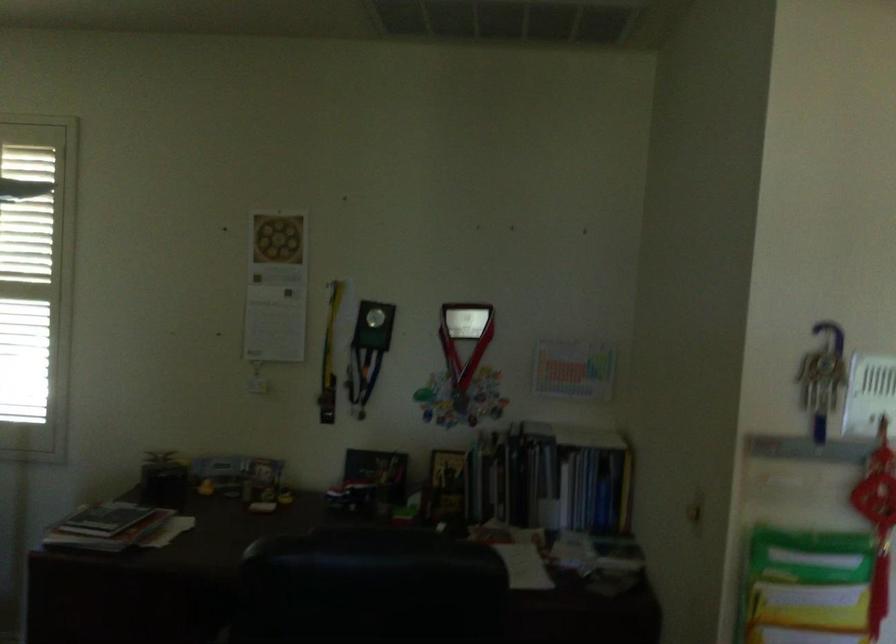
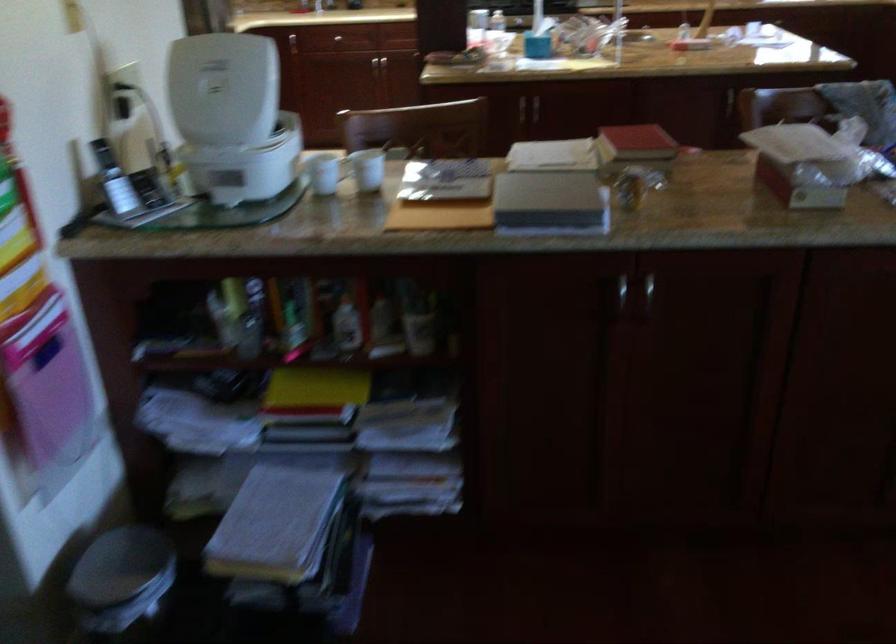
First-person continuous shooting, in which direction is the camera rotating?

The rotation direction of the camera is right-down.